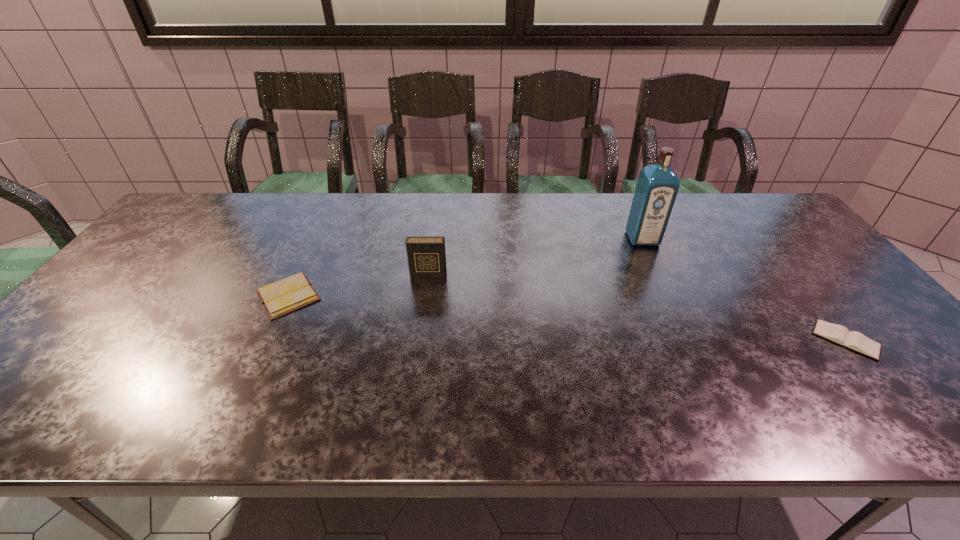
Locate an element on the screen. This screenshot has height=540, width=960. the farthest object is located at coordinates (657, 186).

This screenshot has width=960, height=540. I want to click on liquor, so click(x=657, y=186).

You are a GUI agent. You are given a task and a screenshot of the screen. Output one action in this format:
    pyautogui.click(x=<x>, y=<y>)
    Task: Click on the second diary from right to left
    This screenshot has width=960, height=540.
    Given the screenshot: What is the action you would take?
    pyautogui.click(x=426, y=256)

The width and height of the screenshot is (960, 540). What are the coordinates of `the tallest diary` in the screenshot? It's located at (426, 256).

Find the location of a particular element. the leftmost diary is located at coordinates (286, 295).

You are a GUI agent. You are given a task and a screenshot of the screen. Output one action in this format:
    pyautogui.click(x=<x>, y=<y>)
    Task: Click on the rightmost diary
    The height and width of the screenshot is (540, 960).
    Given the screenshot: What is the action you would take?
    pyautogui.click(x=856, y=341)

You are a GUI agent. You are given a task and a screenshot of the screen. Output one action in this format:
    pyautogui.click(x=<x>, y=<y>)
    Task: Click on the vacant space situated 0.250m on the flat label side of the third object from left to right
    
    Given the screenshot: What is the action you would take?
    674,306

Image resolution: width=960 pixels, height=540 pixels. In order to click on vacant space situated 0.360m on the front cover of the second diary from left to right in this screenshot , I will do `click(413, 393)`.

Locate an element on the screen. This screenshot has height=540, width=960. free point located on the right of the leftmost object is located at coordinates (409, 296).

Where is `vacant area located 0.150m on the back of the rightmost diary`? vacant area located 0.150m on the back of the rightmost diary is located at coordinates (798, 281).